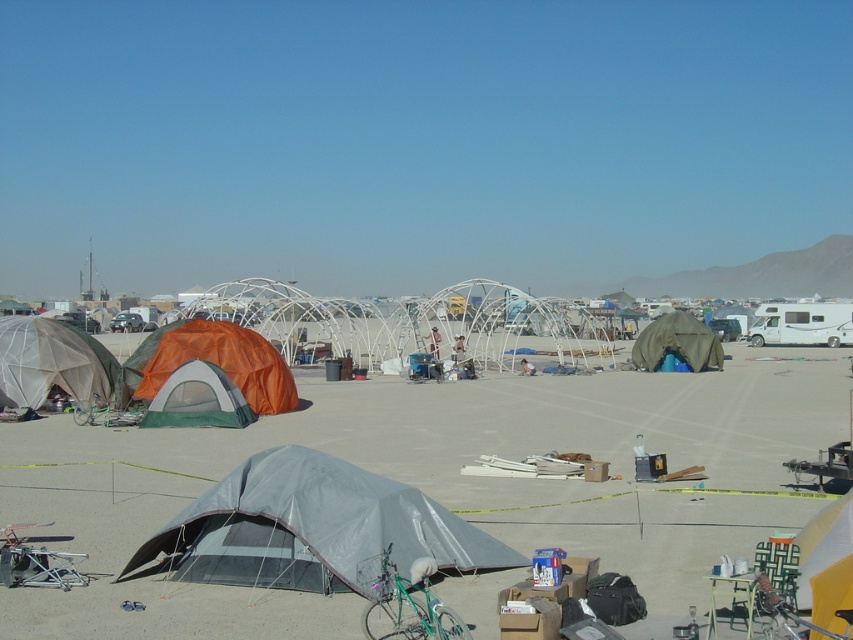
Is matte gray tent at left above green canvas tent at center?

Incorrect, matte gray tent at left is not positioned above green canvas tent at center.

Is matte gray tent at left to the right of green canvas tent at center from the viewer's perspective?

In fact, matte gray tent at left is to the left of green canvas tent at center.

Is point (97, 340) behind point (666, 336)?

No, it is not.

Locate an element on the screen. The image size is (853, 640). matte gray tent at left is located at coordinates (51, 362).

Is matte gray tent at left thinner than orange mesh tent at lower left?

Yes.

Which is below, matte gray tent at left or orange mesh tent at lower left?

Positioned lower is matte gray tent at left.

The image size is (853, 640). Identify the location of matte gray tent at left. (51, 362).

Locate an element on the screen. matte gray tent at left is located at coordinates (51, 362).

Between gray fabric tent at center and green canvas tent at center, which one appears on the right side from the viewer's perspective?

green canvas tent at center

Based on the photo, does gray fabric tent at center have a larger size compared to green canvas tent at center?

Indeed, gray fabric tent at center has a larger size compared to green canvas tent at center.

This screenshot has width=853, height=640. Find the location of `gray fabric tent at center`. gray fabric tent at center is located at coordinates (428, 483).